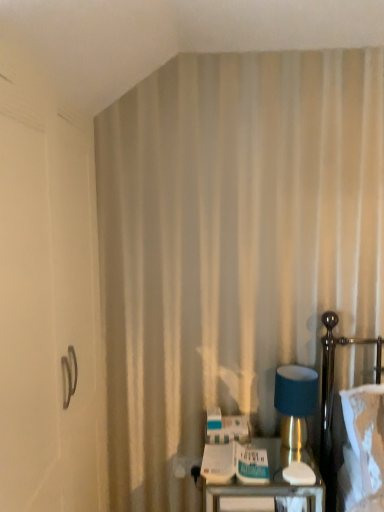
Question: From a real-world perspective, is matte blue fabric at right positioned above or below metallic handle at left?

Choices:
 (A) above
 (B) below

Answer: (B)

Question: Considering the positions of point click(296, 420) and point click(72, 471), is point click(296, 420) closer or farther from the camera than point click(72, 471)?

Choices:
 (A) closer
 (B) farther

Answer: (B)

Question: Which object is the farthest from the metallic silver tray at lower right?

Choices:
 (A) metallic handle at left
 (B) matte blue fabric at right
 (C) white fabric bed at right

Answer: (A)

Question: Estimate the real-world distances between objects in this image. Which object is farther from the metallic silver tray at lower right?

Choices:
 (A) white fabric bed at right
 (B) metallic handle at left
 (C) matte blue fabric at right

Answer: (B)